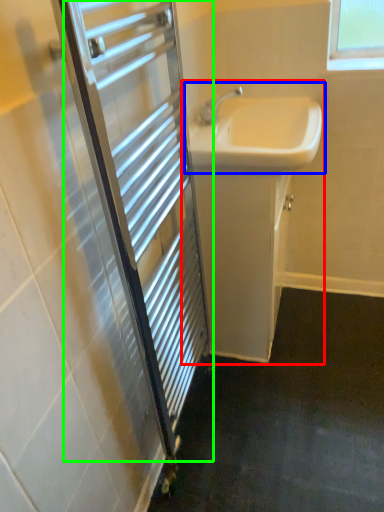
Question: Which object is the farthest from bathroom cabinet (highlighted by a red box)? Choose among these: sink (highlighted by a blue box) or screen door (highlighted by a green box).

Choices:
 (A) sink
 (B) screen door

Answer: (B)